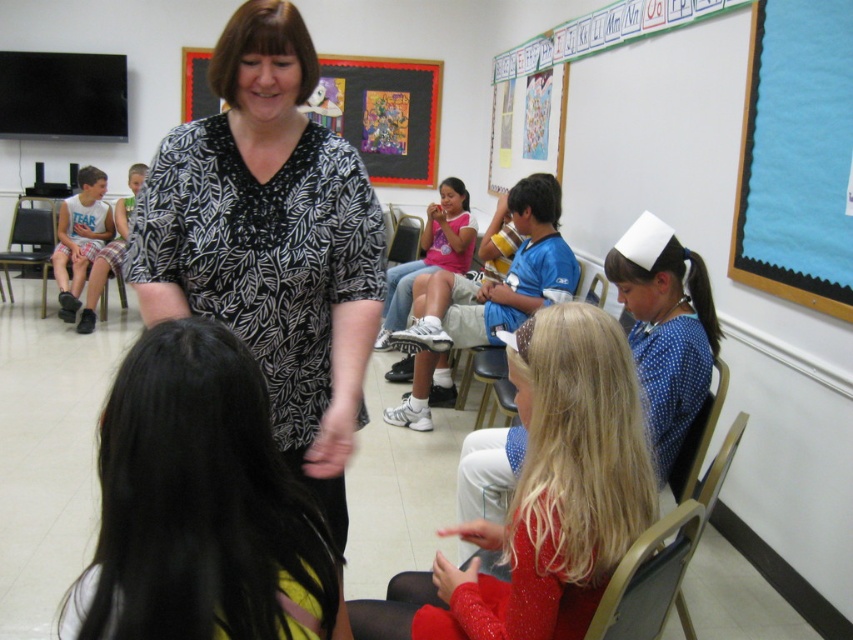
Question: Which point is farther from the camera taking this photo?

Choices:
 (A) (378, 339)
 (B) (550, 193)
 (C) (200, 412)
 (D) (32, 209)

Answer: (D)

Question: Does black printed blouse at center lie behind blue cotton shirt at center?

Choices:
 (A) yes
 (B) no

Answer: (B)

Question: Which object is the closest to the plaid shorts at left?

Choices:
 (A) blue cotton shirt at center
 (B) black matte bulletin board at upper center

Answer: (B)

Question: Does blue dotted dress at center have a greater width compared to blue cotton shirt at center?

Choices:
 (A) no
 (B) yes

Answer: (A)

Question: Which object is the closest to the plaid shorts at left?

Choices:
 (A) black leather chair at left
 (B) brown plastic chair at lower right
 (C) pink fabric shirt at center

Answer: (A)

Question: Is blue cotton shirt at center thinner than plaid shorts at left?

Choices:
 (A) yes
 (B) no

Answer: (B)